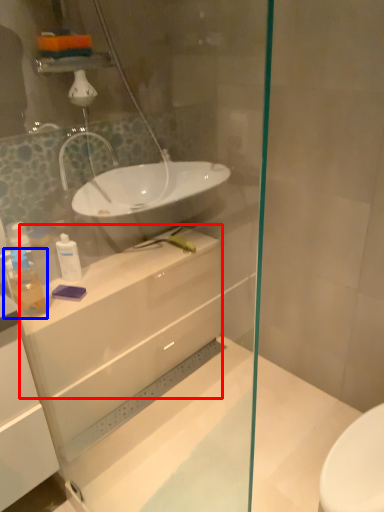
Question: Which point is closer to the camera, counter top (highlighted by a red box) or toiletry (highlighted by a blue box)?

Choices:
 (A) counter top
 (B) toiletry

Answer: (B)